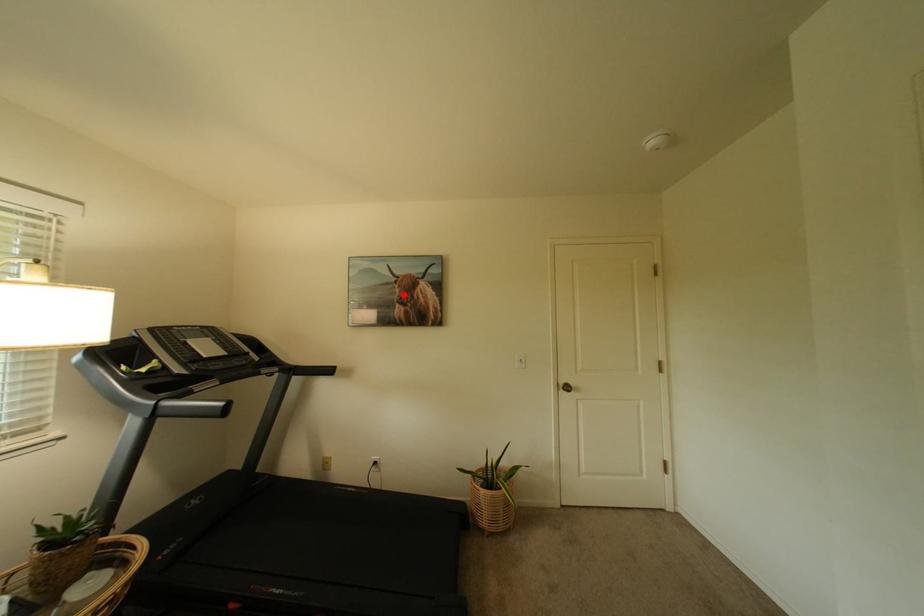
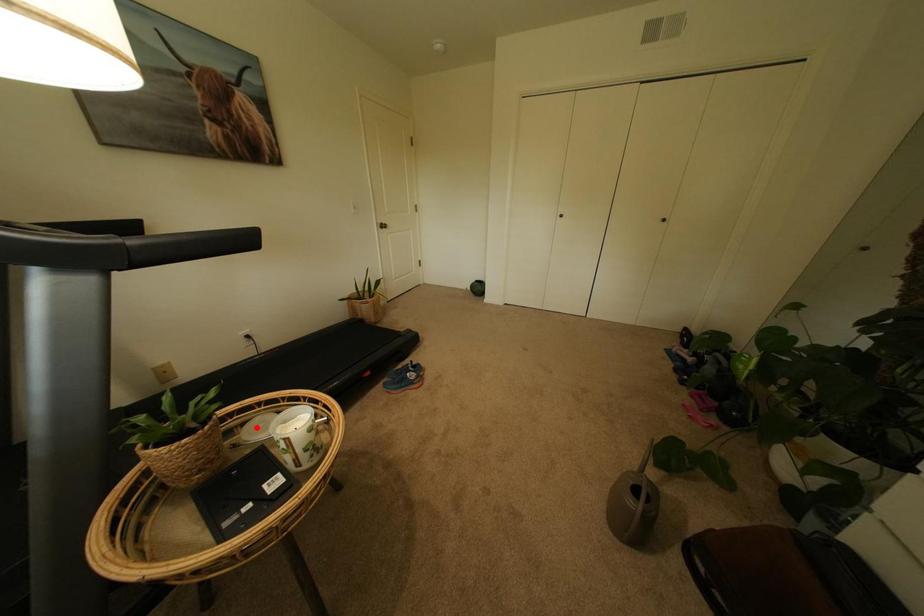
I am providing you with two images of the same scene from different viewpoints. A red point is marked on the first image and another point is marked on the second image. Is the marked point in image1 the same physical position as the marked point in image2?

No